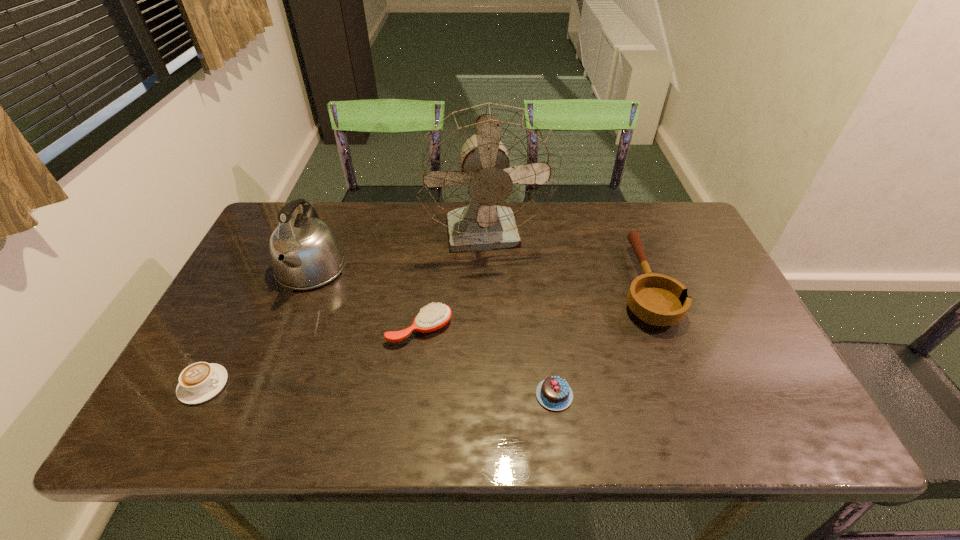
Image resolution: width=960 pixels, height=540 pixels. In order to click on vacant area situated 0.060m with the handle on the side of the rightmost object in this screenshot , I will do `click(624, 233)`.

Find the location of a particular element. The width and height of the screenshot is (960, 540). vacant space positioned with the handle on the side of the rightmost object is located at coordinates (625, 235).

Identify the location of free space located 0.090m on the right of the hairbrush. (488, 329).

Where is `vacant region located 0.110m with the handle on the right side of the cappuccino`? The image size is (960, 540). vacant region located 0.110m with the handle on the right side of the cappuccino is located at coordinates (276, 384).

Where is `vacant area situated on the back of the chocolate cake`? The image size is (960, 540). vacant area situated on the back of the chocolate cake is located at coordinates (546, 337).

Identify the location of fan that is positioned at the far edge. (484, 171).

You are a GUI agent. You are given a task and a screenshot of the screen. Output one action in this format:
    pyautogui.click(x=<x>, y=<y>)
    Task: Click on the kettle located in the far edge section of the desktop
    
    Given the screenshot: What is the action you would take?
    pyautogui.click(x=305, y=253)

Locate an element on the screen. Image resolution: width=960 pixels, height=540 pixels. saucepan present at the far edge is located at coordinates (656, 299).

Where is `cappuccino located in the near edge section of the desktop`? Image resolution: width=960 pixels, height=540 pixels. cappuccino located in the near edge section of the desktop is located at coordinates (199, 382).

Identify the location of chocolate cake at the near edge. (554, 393).